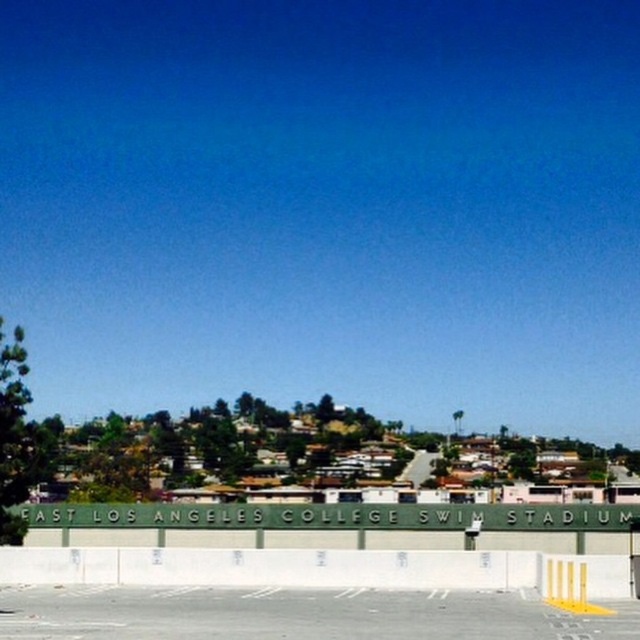
Does gray asphalt parking lot at lower center have a lesser width compared to white concrete barrier at lower center?

Correct, gray asphalt parking lot at lower center's width is less than white concrete barrier at lower center's.

Which is behind, point (628, 625) or point (67, 570)?

The point (67, 570) is behind.

The image size is (640, 640). Find the location of `gray asphalt parking lot at lower center`. gray asphalt parking lot at lower center is located at coordinates (294, 614).

Identify the location of gray asphalt parking lot at lower center. This screenshot has height=640, width=640. click(x=294, y=614).